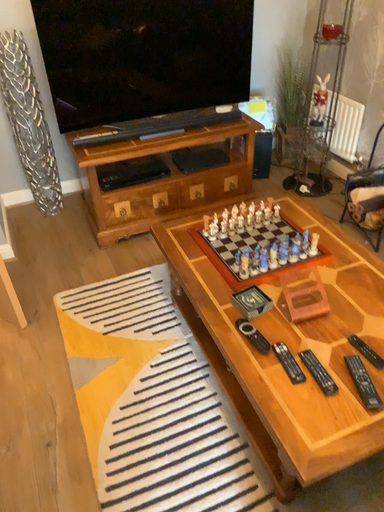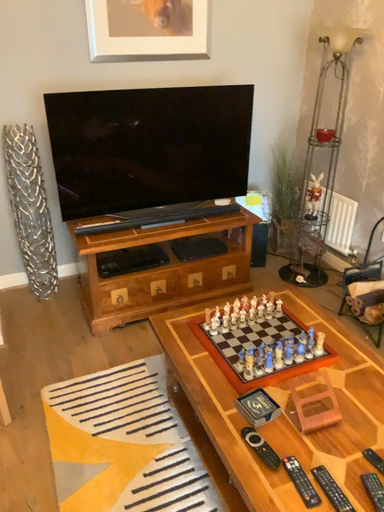
Question: Which way did the camera rotate in the video?

Choices:
 (A) rotated downward
 (B) rotated upward

Answer: (B)